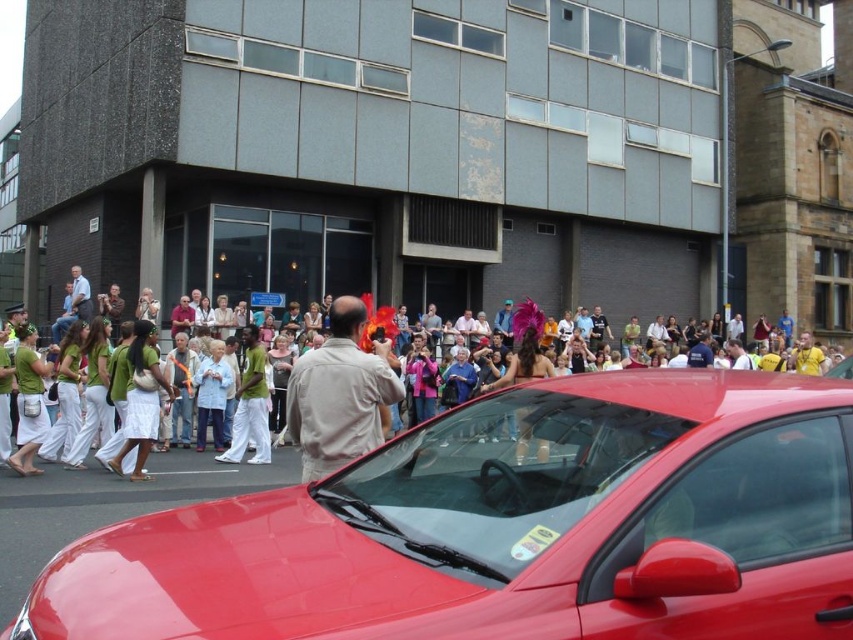
You are standing at the point marked by the coordinates point (692, 388) in the image. What object or feature is directly in front of you?

The point (692, 388) marks the matte khaki shirt at center, so the object directly in front of you is the matte khaki shirt at center.

You are a photographer standing on the street and want to take a picture of both the glossy red car at center and the matte khaki shirt at center. Which object should you focus on first to ensure it appears sharp in the photo?

The glossy red car at center is above the matte khaki shirt at center, so you should focus on the glossy red car at center first to ensure it appears sharp in the photo.